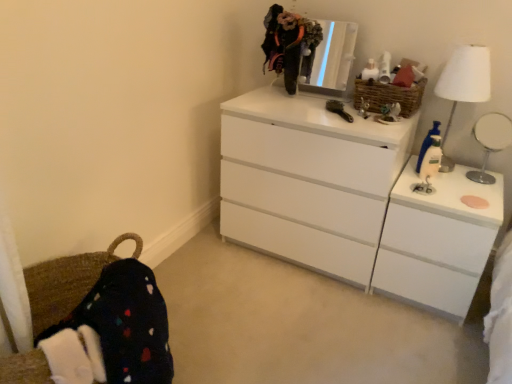
What are the coordinates of `vacant space that is to the left of fuzzy fabric at upper center` in the screenshot? It's located at (254, 95).